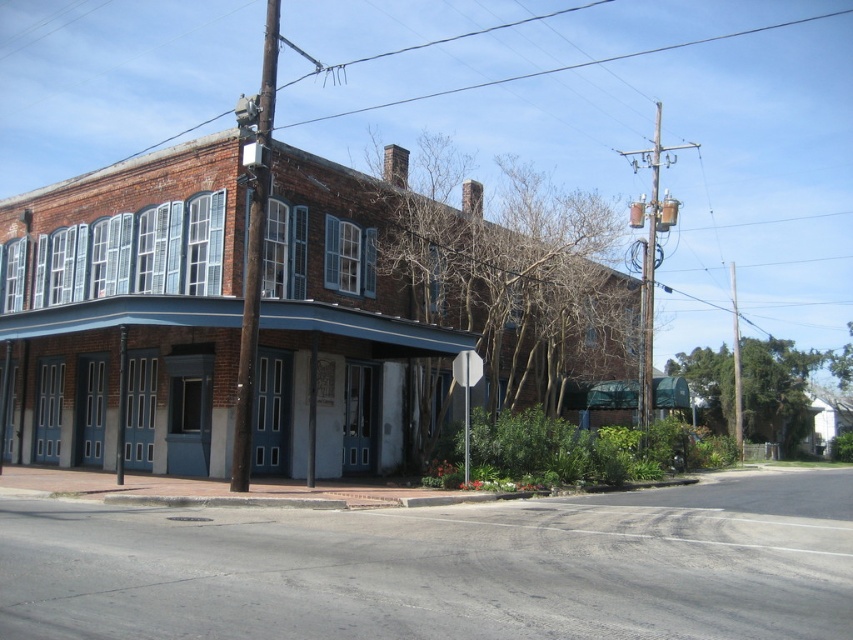
Can you confirm if brown wooden pole at upper center is thinner than white glossy stop sign at center?

In fact, brown wooden pole at upper center might be wider than white glossy stop sign at center.

Identify the location of brown wooden pole at upper center. This screenshot has height=640, width=853. (254, 257).

Identify the location of brown wooden pole at upper center. (254, 257).